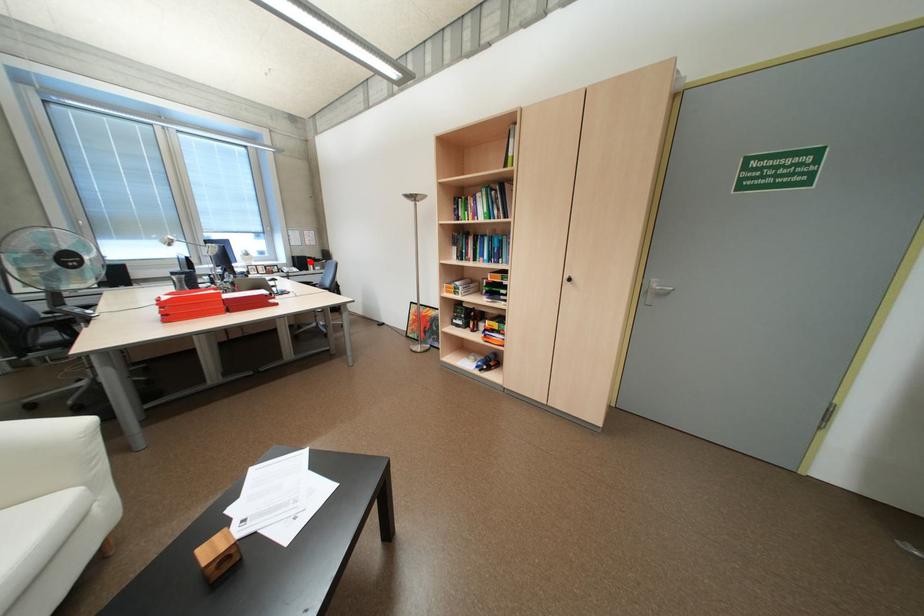
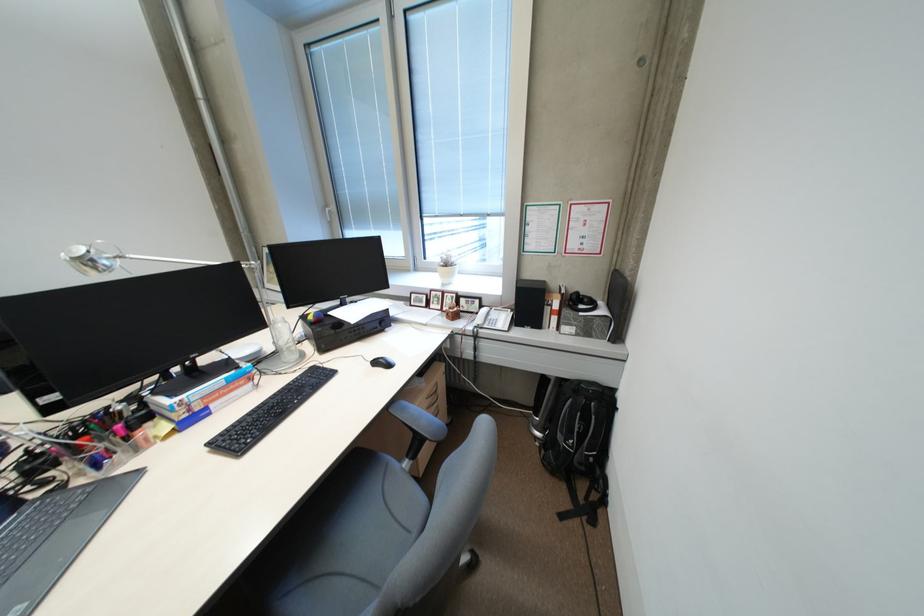
Find the pixel in the second image that matches the highlighted location in the first image.

(538, 302)